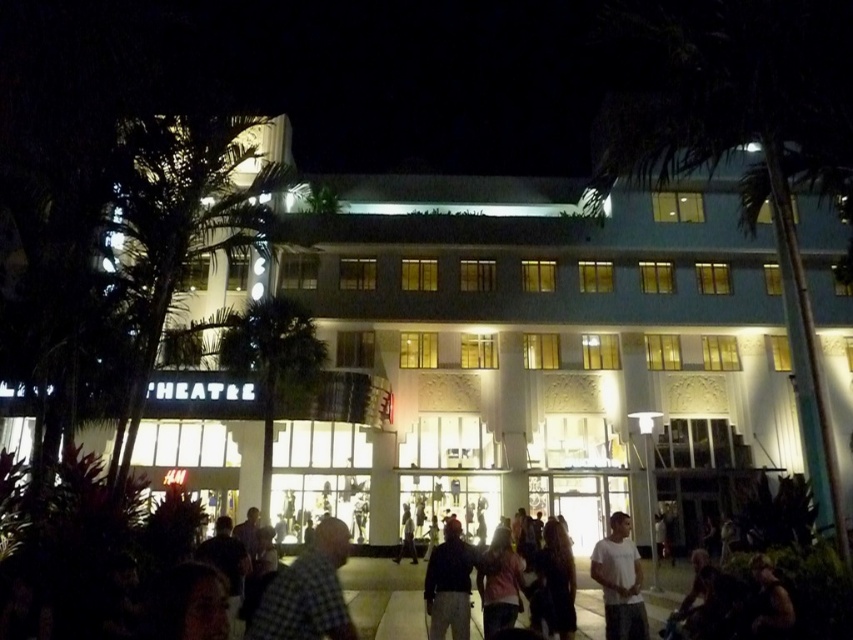
Question: Estimate the real-world distances between objects in this image. Which object is farther from the checkered fabric shirt at center?

Choices:
 (A) dark gray fabric jacket at center
 (B) green leafy palm tree at left
 (C) dark clothing at center
 (D) green leafy palm tree at upper right

Answer: (D)

Question: Which point is closer to the camera?

Choices:
 (A) (338, 545)
 (B) (639, 628)

Answer: (A)

Question: Does green leafy palm tree at center lie behind dark gray fabric jacket at center?

Choices:
 (A) yes
 (B) no

Answer: (A)

Question: Does dark clothing at center have a smaller size compared to checkered fabric shirt at center?

Choices:
 (A) yes
 (B) no

Answer: (B)

Question: Is green leafy palm tree at left further to the viewer compared to dark gray fabric jacket at center?

Choices:
 (A) no
 (B) yes

Answer: (B)

Question: Which object appears closest to the camera in this image?

Choices:
 (A) dark gray fabric jacket at center
 (B) dark clothing at center
 (C) green leafy palm tree at center
 (D) green leafy palm tree at left

Answer: (B)